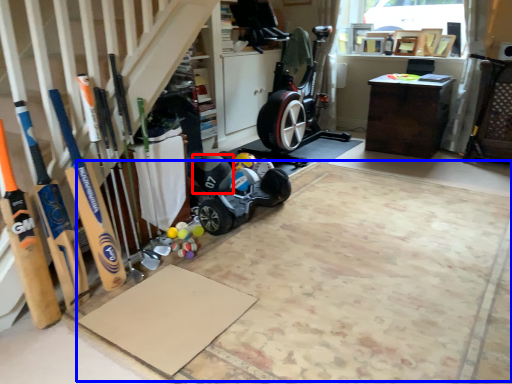
Question: Which of the following is the closest to the observer, sports equipment (highlighted by a red box) or yoga mat (highlighted by a blue box)?

Choices:
 (A) sports equipment
 (B) yoga mat

Answer: (B)